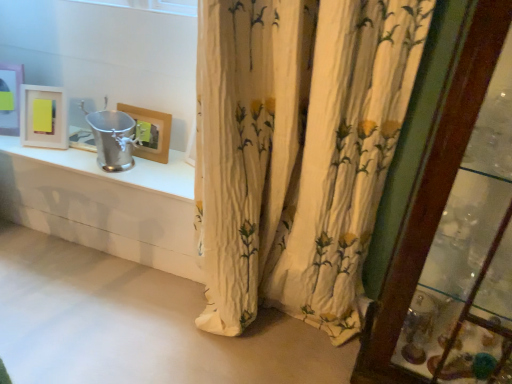
I want to click on vacant area located to the right-hand side of matte wooden picture frame at upper center, the first picture frame in the right-to-left sequence, so click(178, 168).